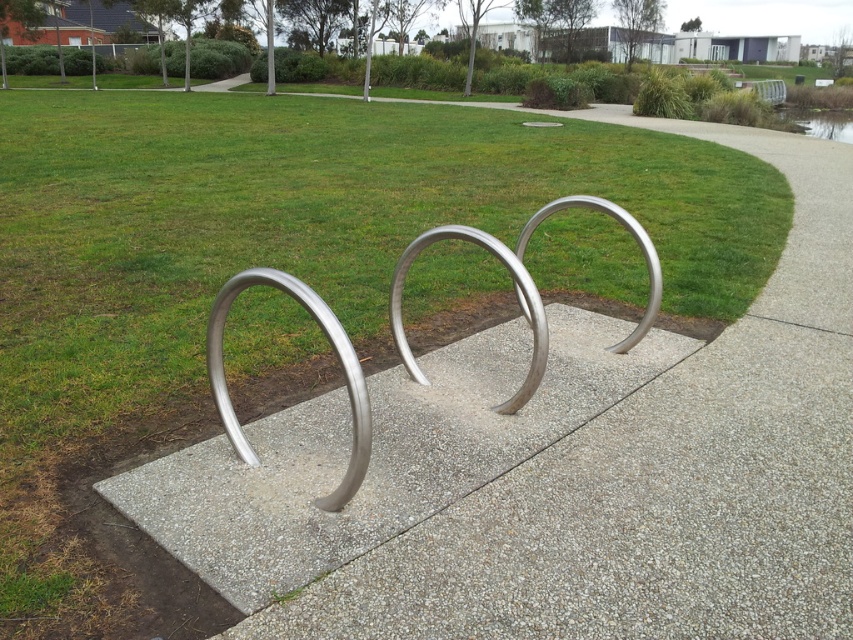
In the scene shown: Does sanded concrete at center have a lesser width compared to polished metal bike rack at center?

No, sanded concrete at center is not thinner than polished metal bike rack at center.

Can you confirm if sanded concrete at center is shorter than polished metal bike rack at center?

No.

This screenshot has width=853, height=640. What do you see at coordinates (378, 452) in the screenshot?
I see `sanded concrete at center` at bounding box center [378, 452].

The height and width of the screenshot is (640, 853). In order to click on sanded concrete at center in this screenshot , I will do `click(378, 452)`.